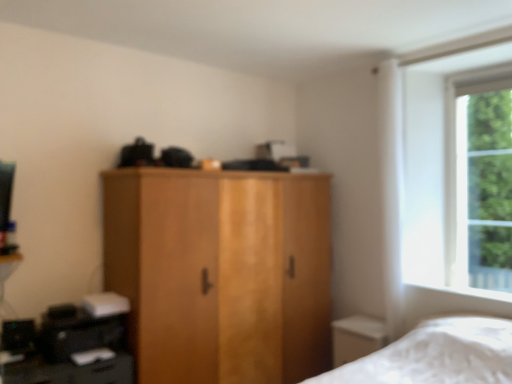
Question: From the image's perspective, is wooden wardrobe at center located above or below black plastic printer at lower left?

Choices:
 (A) below
 (B) above

Answer: (B)

Question: Considering the positions of wooden wardrobe at center and black plastic printer at lower left in the image, is wooden wardrobe at center taller or shorter than black plastic printer at lower left?

Choices:
 (A) tall
 (B) short

Answer: (A)

Question: Which is farther from the black plastic printer at lower left?

Choices:
 (A) wooden wardrobe at center
 (B) green leafy tree at right

Answer: (B)

Question: Estimate the real-world distances between objects in this image. Which object is closer to the black plastic printer at lower left?

Choices:
 (A) green leafy tree at right
 (B) wooden wardrobe at center

Answer: (B)